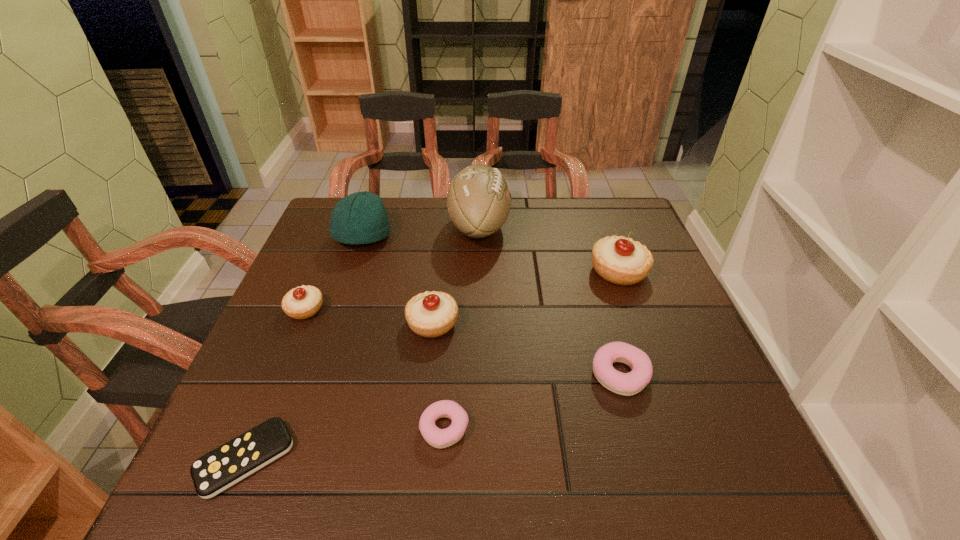
This screenshot has height=540, width=960. In order to click on free location located 0.230m on the back of the remote control in this screenshot , I will do `click(300, 329)`.

Image resolution: width=960 pixels, height=540 pixels. I want to click on football (American) that is at the far edge, so click(x=478, y=200).

At what (x,y) coordinates should I click in order to perform the action: click on beanie that is at the far edge. Please return your answer as a coordinate pair (x, y). The height and width of the screenshot is (540, 960). Looking at the image, I should click on (360, 218).

The width and height of the screenshot is (960, 540). In order to click on pastry positioned at the near edge in this screenshot , I will do `click(439, 438)`.

The image size is (960, 540). What are the coordinates of `remote control positioned at the near edge` in the screenshot? It's located at (216, 471).

Where is `beanie present at the left edge`? Image resolution: width=960 pixels, height=540 pixels. beanie present at the left edge is located at coordinates (360, 218).

The width and height of the screenshot is (960, 540). Find the location of `pastry located at the left edge`. pastry located at the left edge is located at coordinates (303, 302).

This screenshot has height=540, width=960. In order to click on remote control at the left edge in this screenshot , I will do `click(216, 471)`.

At what (x,y) coordinates should I click in order to perform the action: click on object that is at the far left corner. Please return your answer as a coordinate pair (x, y). Looking at the image, I should click on (360, 218).

The height and width of the screenshot is (540, 960). Identify the location of object that is at the near left corner. (216, 471).